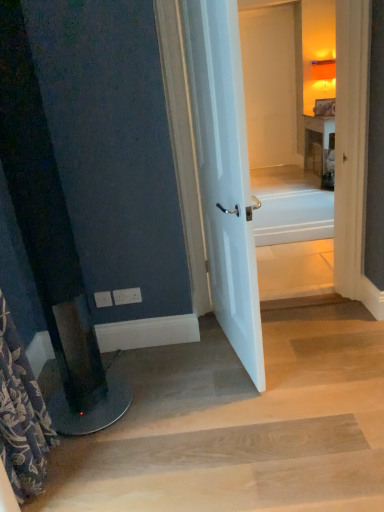
Question: In terms of height, does white plastic electric outlet at lower left, placed as the first electric outlet when sorted from left to right, look taller or shorter compared to white glossy bathtub at center?

Choices:
 (A) tall
 (B) short

Answer: (A)

Question: In the image, is white plastic electric outlet at lower left, the second electric outlet in the right-to-left sequence, positioned in front of or behind white glossy bathtub at center?

Choices:
 (A) behind
 (B) front

Answer: (B)

Question: Estimate the real-world distances between objects in this image. Which object is closer to the white glossy door at center?

Choices:
 (A) white glossy bathtub at center
 (B) white plastic electric outlet at lower left, the second electric outlet in the right-to-left sequence
 (C) floral fabric shower curtain at left
 (D) light brown wood at lower center
 (E) white plastic electric outlet at lower left, acting as the first electric outlet starting from the right

Answer: (D)

Question: Estimate the real-world distances between objects in this image. Which object is closer to the white plastic electric outlet at lower left, which ranks as the 2th electric outlet in left-to-right order?

Choices:
 (A) white glossy door at center
 (B) white glossy bathtub at center
 (C) light brown wood at lower center
 (D) white plastic electric outlet at lower left, placed as the first electric outlet when sorted from left to right
 (E) floral fabric shower curtain at left

Answer: (D)